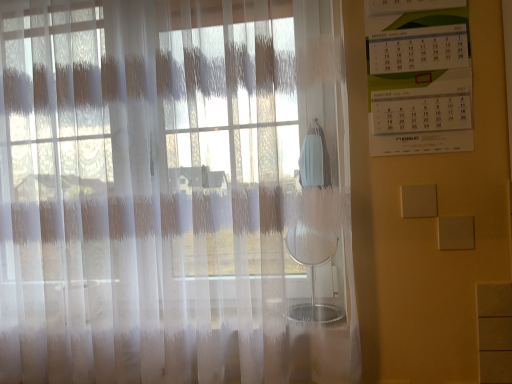
Question: Considering the relative positions of translucent white curtain at left and white paper calendar at upper right in the image provided, is translucent white curtain at left to the left of white paper calendar at upper right from the viewer's perspective?

Choices:
 (A) yes
 (B) no

Answer: (A)

Question: From the image's perspective, is translucent white curtain at left under white paper calendar at upper right?

Choices:
 (A) yes
 (B) no

Answer: (A)

Question: From a real-world perspective, does translucent white curtain at left stand above white paper calendar at upper right?

Choices:
 (A) yes
 (B) no

Answer: (B)

Question: Could you tell me if translucent white curtain at left is facing white paper calendar at upper right?

Choices:
 (A) no
 (B) yes

Answer: (A)

Question: From the image's perspective, would you say translucent white curtain at left is positioned over white paper calendar at upper right?

Choices:
 (A) yes
 (B) no

Answer: (B)

Question: Considering the relative sizes of translucent white curtain at left and white paper calendar at upper right in the image provided, is translucent white curtain at left taller than white paper calendar at upper right?

Choices:
 (A) yes
 (B) no

Answer: (A)

Question: Is white paper calendar at upper right in front of translucent white curtain at left?

Choices:
 (A) yes
 (B) no

Answer: (B)

Question: Is white paper calendar at upper right to the left of translucent white curtain at left from the viewer's perspective?

Choices:
 (A) no
 (B) yes

Answer: (A)

Question: Is white paper calendar at upper right outside of translucent white curtain at left?

Choices:
 (A) no
 (B) yes

Answer: (B)

Question: Can you confirm if white paper calendar at upper right is taller than translucent white curtain at left?

Choices:
 (A) yes
 (B) no

Answer: (B)

Question: Does white paper calendar at upper right have a greater width compared to translucent white curtain at left?

Choices:
 (A) yes
 (B) no

Answer: (B)

Question: Can you confirm if white paper calendar at upper right is smaller than translucent white curtain at left?

Choices:
 (A) no
 (B) yes

Answer: (B)

Question: In the image, is translucent white curtain at left positioned in front of or behind white paper calendar at upper right?

Choices:
 (A) front
 (B) behind

Answer: (A)